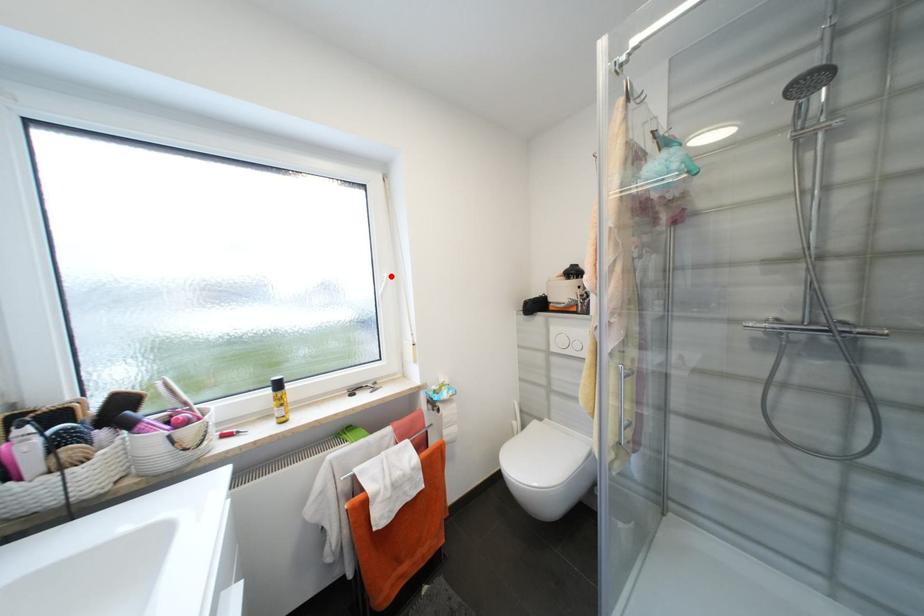
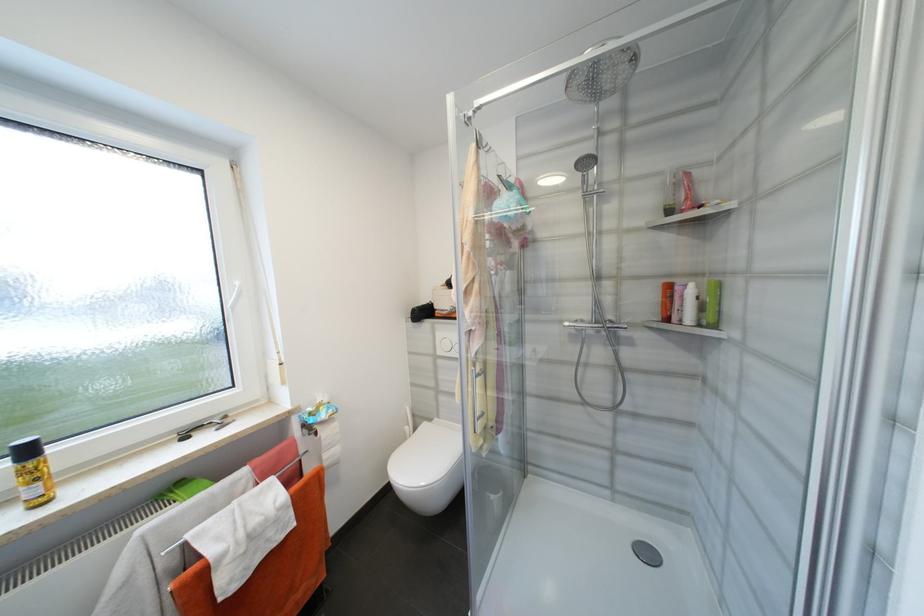
Find the pixel in the second image that matches the highlighted location in the first image.

(242, 285)